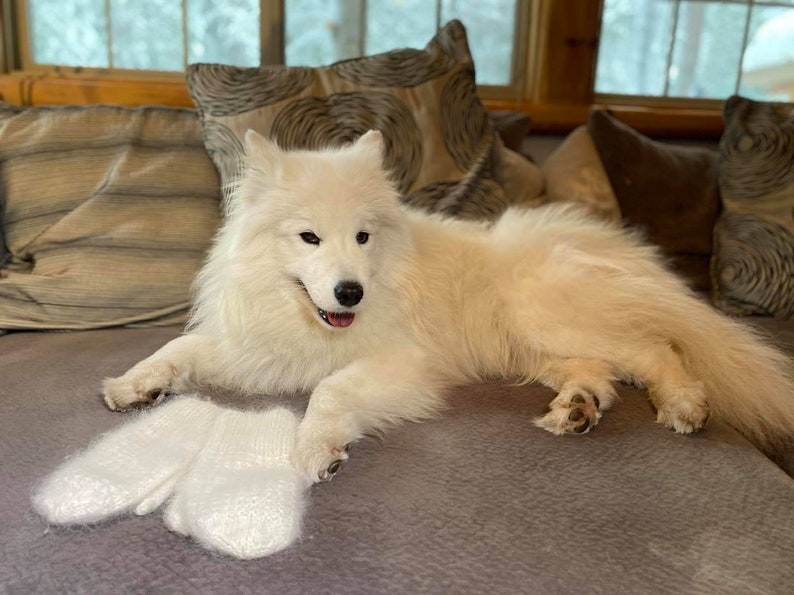
You are a GUI agent. You are given a task and a screenshot of the screen. Output one action in this format:
    pyautogui.click(x=<x>, y=<y>)
    Task: Click on the windows
    Image resolution: width=794 pixels, height=595 pixels.
    Given the screenshot: What is the action you would take?
    pyautogui.click(x=711, y=46), pyautogui.click(x=313, y=36), pyautogui.click(x=114, y=36)